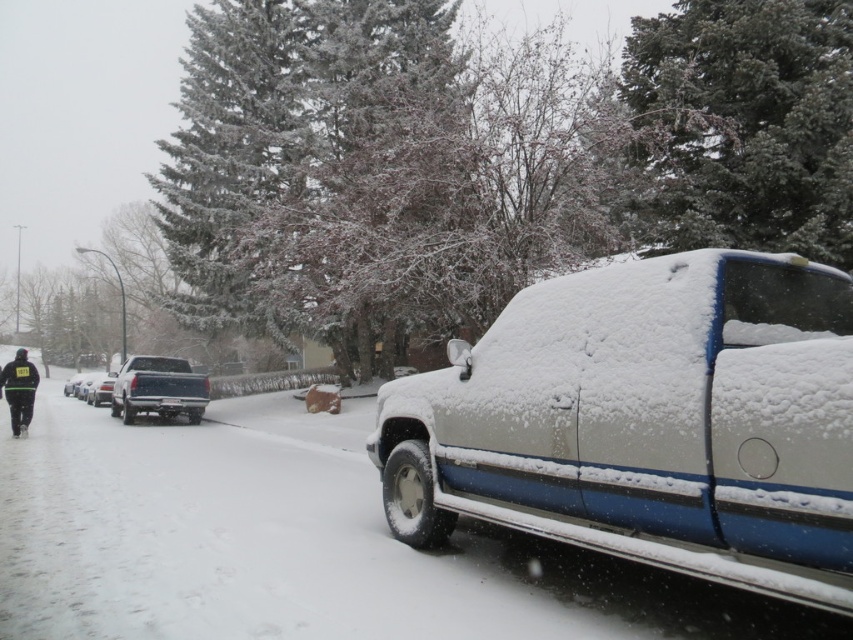
Question: Estimate the real-world distances between objects in this image. Which object is closer to the matte black truck at center?

Choices:
 (A) black fabric jacket at lower left
 (B) white matte truck at center
 (C) silver metallic truck at center

Answer: (A)

Question: Which of the following is the closest to the observer?

Choices:
 (A) black fabric jacket at lower left
 (B) silver metallic truck at center
 (C) white matte truck at center

Answer: (C)

Question: Estimate the real-world distances between objects in this image. Which object is closer to the silver metallic truck at center?

Choices:
 (A) black fabric jacket at lower left
 (B) white matte truck at center
 (C) matte black truck at center

Answer: (C)

Question: Is white matte truck at center to the left of black fabric jacket at lower left from the viewer's perspective?

Choices:
 (A) yes
 (B) no

Answer: (B)

Question: Is the position of white matte truck at center less distant than that of black fabric jacket at lower left?

Choices:
 (A) yes
 (B) no

Answer: (A)

Question: Does white matte truck at center appear under matte black truck at center?

Choices:
 (A) yes
 (B) no

Answer: (B)